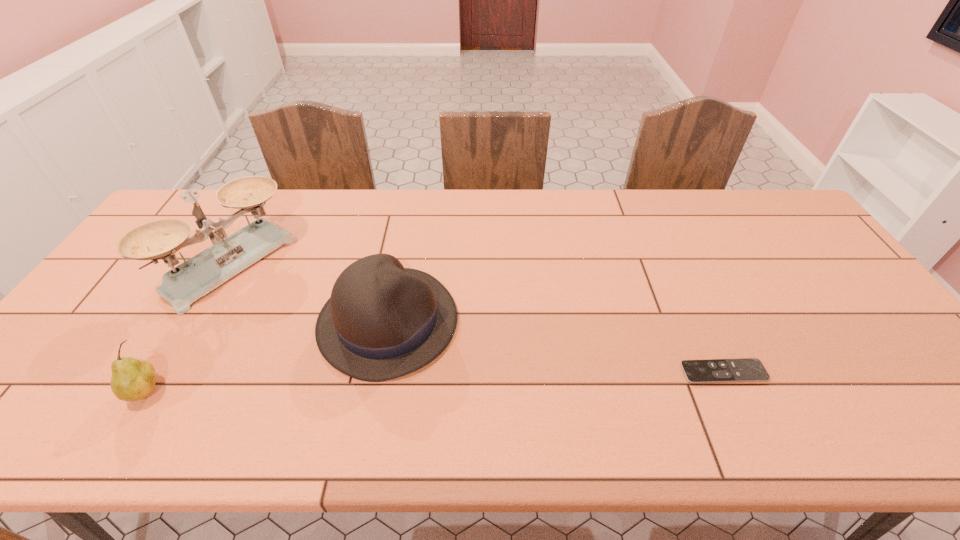
What are the coordinates of `the third tallest object` in the screenshot? It's located at (132, 379).

Locate an element on the screen. the shortest object is located at coordinates 749,369.

Identify the location of remote control. (749, 369).

The image size is (960, 540). In order to click on the tallest object in this screenshot , I will do `click(181, 286)`.

Image resolution: width=960 pixels, height=540 pixels. Identify the location of bowler hat. (383, 321).

Locate an element on the screen. The height and width of the screenshot is (540, 960). the second object from right to left is located at coordinates (383, 321).

Find the location of a particular element. Image resolution: width=960 pixels, height=540 pixels. free region located on the back of the pear is located at coordinates [x=179, y=339].

Locate an element on the screen. The height and width of the screenshot is (540, 960). vacant space located 0.380m on the left of the remote control is located at coordinates (521, 372).

You are a GUI agent. You are given a task and a screenshot of the screen. Output one action in this format:
    pyautogui.click(x=<x>, y=<y>)
    Task: Click on the free point located 0.400m on the front-facing side of the scale
    Image resolution: width=960 pixels, height=540 pixels.
    Given the screenshot: What is the action you would take?
    pyautogui.click(x=366, y=363)

You are a GUI agent. You are given a task and a screenshot of the screen. Output one action in this format:
    pyautogui.click(x=<x>, y=<y>)
    Task: Click on the vacant region located 0.350m on the front-facing side of the scale
    The width and height of the screenshot is (960, 540).
    Given the screenshot: What is the action you would take?
    pyautogui.click(x=351, y=354)